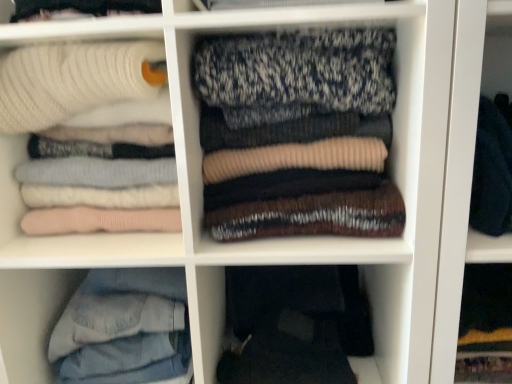
Question: Is denim jeans at lower left taller or shorter than white ribbed sweater at upper left, the 2th laundry in the right-to-left sequence?

Choices:
 (A) short
 (B) tall

Answer: (A)

Question: Looking at the image, does denim jeans at lower left seem bigger or smaller compared to white ribbed sweater at upper left, the 2th laundry in the right-to-left sequence?

Choices:
 (A) small
 (B) big

Answer: (A)

Question: Which object is positioned farthest from the white ribbed sweater at upper left, the 2th laundry in the right-to-left sequence?

Choices:
 (A) dark gray fabric pants at lower center
 (B) denim jeans at lower left
 (C) knit sweater at center, the first laundry from the right

Answer: (A)

Question: Which of these objects is positioned closest to the denim jeans at lower left?

Choices:
 (A) knit sweater at center, the first laundry from the right
 (B) white ribbed sweater at upper left, the 2th laundry in the right-to-left sequence
 (C) dark gray fabric pants at lower center

Answer: (C)